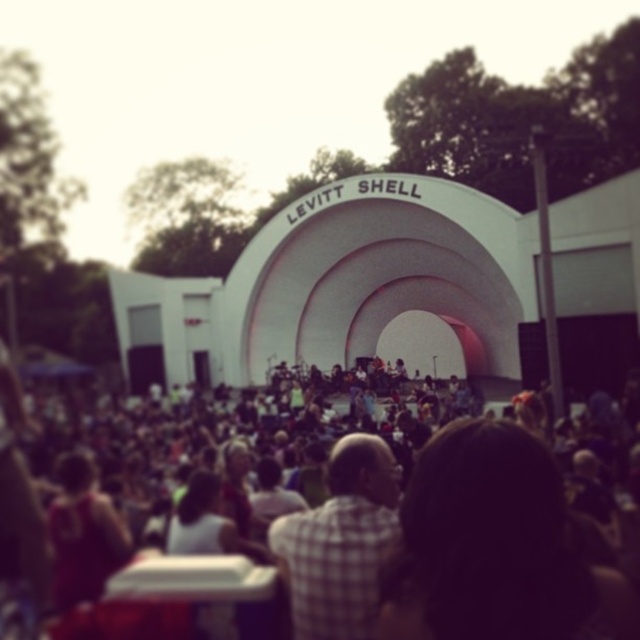
You are a photographer at the Levitt Shell concert. You want to capture a photo that includes both the white smooth levitt shell at center and the checkered fabric shirt at center. Which object should you focus on first to ensure both fit in the frame?

The white smooth levitt shell at center is bigger than the checkered fabric shirt at center, so you should focus on the larger white smooth levitt shell at center first to ensure it fits properly in the frame, allowing space for the smaller checkered fabric shirt at center.

From the picture: You are standing at the edge of the crowd and want to take a photo of the checkered fabric shirt at center and the white smooth levitt shell at center. Which object should you frame first in your camera to ensure both are in the shot?

The white smooth levitt shell at center is to the left of the checkered fabric shirt at center, so you should frame the white smooth levitt shell at center first on the left side of the camera viewfinder to include both objects in the shot.

You are a photographer at the Levitt Shell event. You want to take a photo of the checkered fabric crowd at center without the white smooth levitt shell at center blocking the view. Is it possible?

The checkered fabric crowd at center is positioned under the white smooth levitt shell at center, so the shell will block the view of the crowd. Therefore, it is not possible to take a photo of the checkered fabric crowd at center without the white smooth levitt shell at center blocking the view.